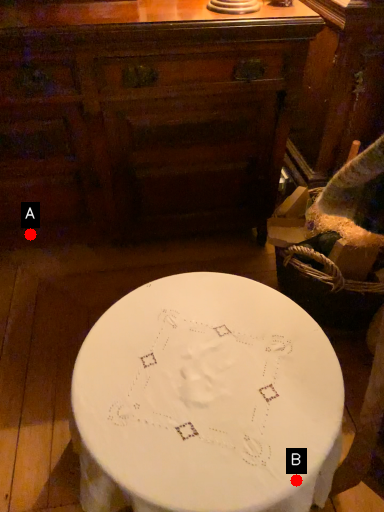
Question: Two points are circled on the image, labeled by A and B beside each circle. Among these points, which one is nearest to the camera?

Choices:
 (A) A is closer
 (B) B is closer

Answer: (B)